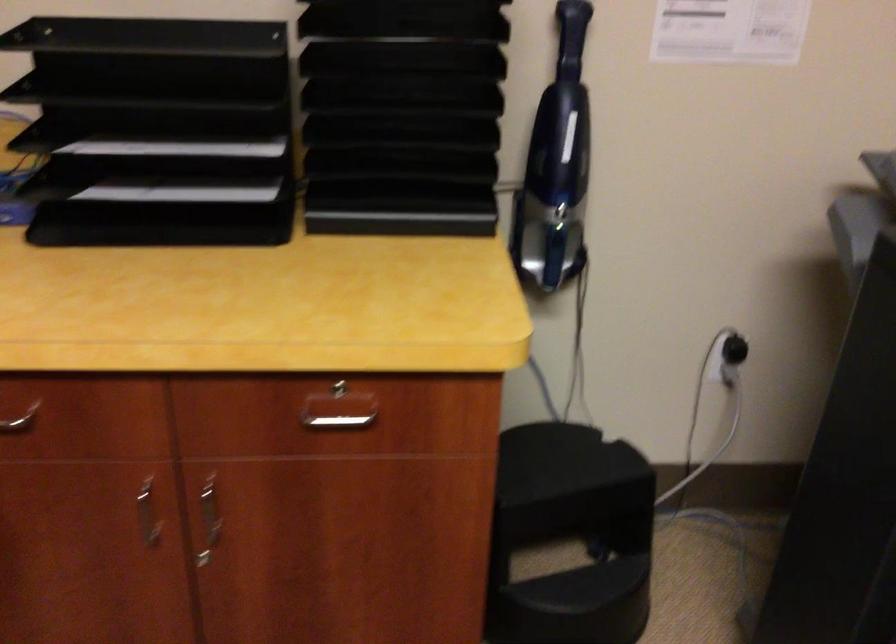
Find the location of a particular element. black electrical plug is located at coordinates (730, 357).